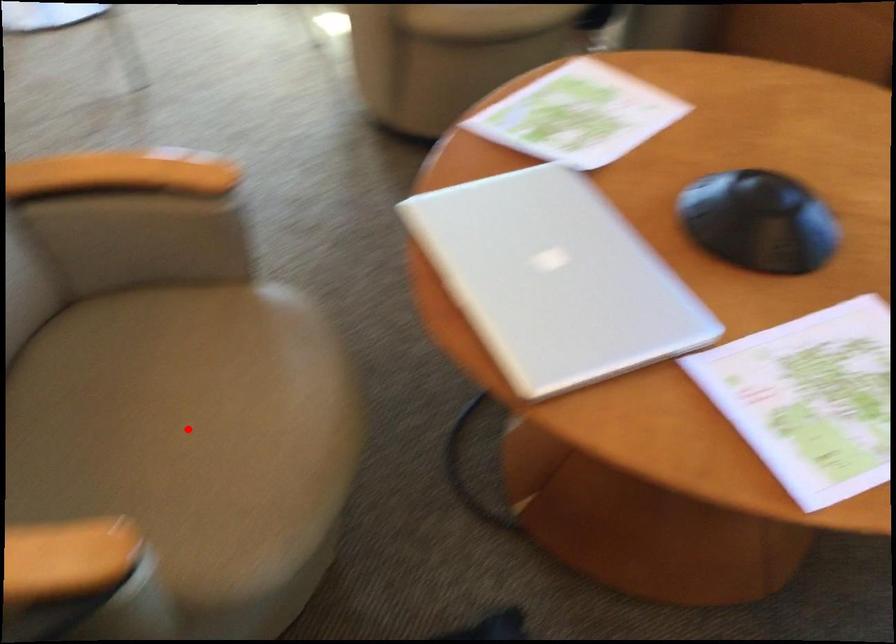
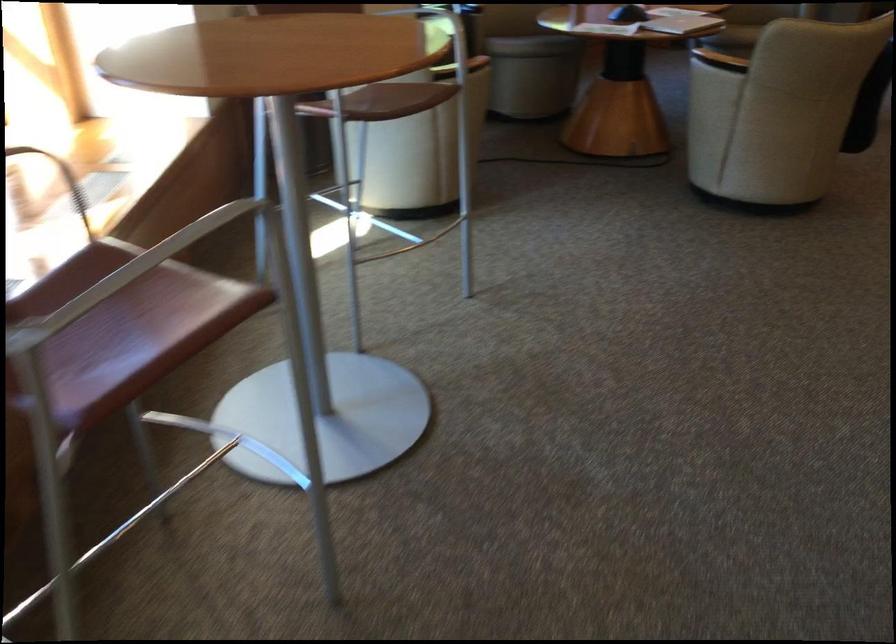
Question: I am providing you with two images of the same scene from different viewpoints. A red point is marked on the first image. Can you still see the location of the red point in image 2?

Choices:
 (A) Yes
 (B) No

Answer: (B)